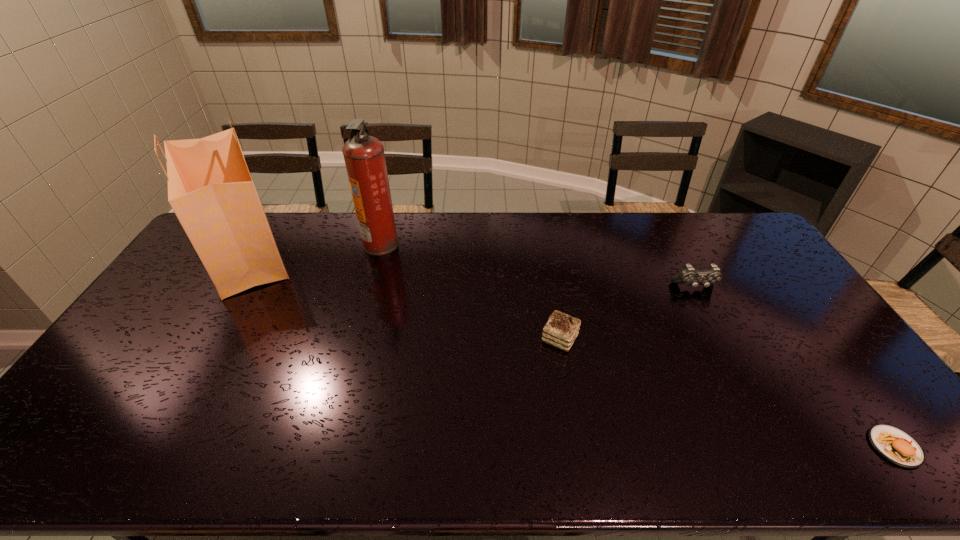
In order to click on free spot located on the surface of the second object from right to left with buttons in this screenshot , I will do `click(729, 353)`.

Where is `free location located on the left of the fourth tallest object`? The width and height of the screenshot is (960, 540). free location located on the left of the fourth tallest object is located at coordinates (499, 339).

What are the coordinates of `vacant space situated on the back of the patty` in the screenshot? It's located at (840, 371).

Image resolution: width=960 pixels, height=540 pixels. In order to click on fire extinguisher at the far edge in this screenshot , I will do `click(364, 156)`.

Locate an element on the screen. grocery bag located at the far edge is located at coordinates [210, 189].

Identify the location of object at the near edge. (898, 447).

This screenshot has height=540, width=960. Find the location of `object present at the left edge`. object present at the left edge is located at coordinates (210, 189).

Identify the location of object at the right edge. The height and width of the screenshot is (540, 960). (898, 447).

What are the coordinates of `object that is at the far left corner` in the screenshot? It's located at (210, 189).

Locate an element on the screen. The height and width of the screenshot is (540, 960). object at the near right corner is located at coordinates [x=898, y=447].